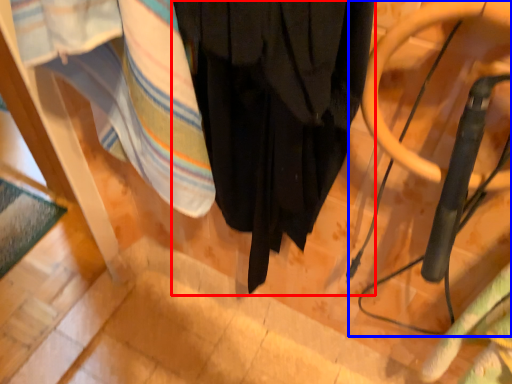
Question: Among these objects, which one is farthest to the camera, curtain (highlighted by a red box) or swivel chair (highlighted by a blue box)?

Choices:
 (A) curtain
 (B) swivel chair

Answer: (A)